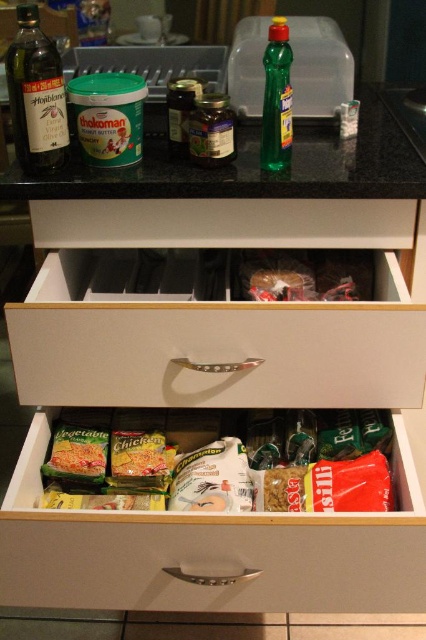
Can you confirm if wooden drawer at center is thinner than green plastic bottle at center?

Incorrect, wooden drawer at center's width is not less than green plastic bottle at center's.

In the scene shown: Which of these two, wooden drawer at center or green plastic bottle at center, stands taller?

Standing taller between the two is wooden drawer at center.

Measure the distance between wooden drawer at center and camera.

wooden drawer at center and camera are 30.47 inches apart from each other.

Locate an element on the screen. The width and height of the screenshot is (426, 640). wooden drawer at center is located at coordinates (215, 548).

Does matte plastic bag of pasta at center have a greater width compared to matte glass bottle at left?

Indeed, matte plastic bag of pasta at center has a greater width compared to matte glass bottle at left.

Find the location of `matte plastic bag of pasta at center`. matte plastic bag of pasta at center is located at coordinates (227, 467).

Which is behind, point (333, 412) or point (36, 49)?

Positioned behind is point (333, 412).

The image size is (426, 640). I want to click on matte plastic bag of pasta at center, so click(227, 467).

Does white matte drawer at center have a smaller size compared to green glossy countertop at center?

Yes.

Does white matte drawer at center have a lesser width compared to green glossy countertop at center?

Indeed, white matte drawer at center has a lesser width compared to green glossy countertop at center.

Is point (161, 385) closer to viewer compared to point (238, 173)?

No.

Identify the location of white matte drawer at center. Image resolution: width=426 pixels, height=640 pixels. (213, 346).